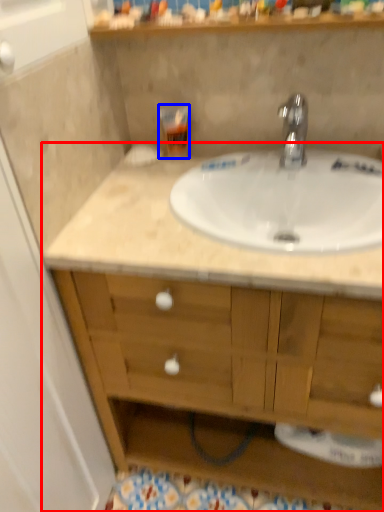
Question: Among these objects, which one is nearest to the camera, bathroom cabinet (highlighted by a red box) or toiletry (highlighted by a blue box)?

Choices:
 (A) bathroom cabinet
 (B) toiletry

Answer: (A)